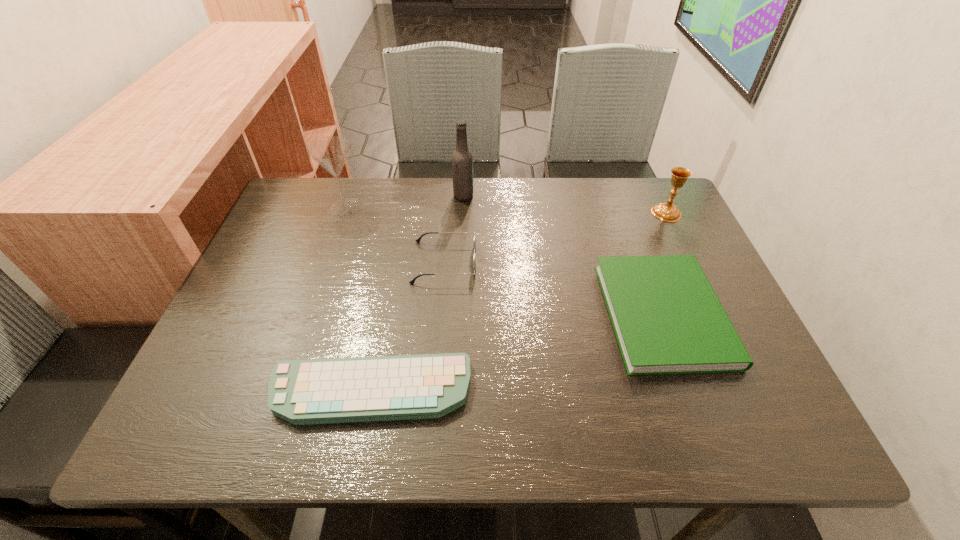
Identify the location of vacant region between the chalice and the flute glass. Image resolution: width=960 pixels, height=540 pixels. (506, 210).

The width and height of the screenshot is (960, 540). In order to click on vacant space in between the fourth shortest object and the tallest object in this screenshot , I will do `click(564, 204)`.

This screenshot has width=960, height=540. Identify the location of blank region between the second tallest object and the sunglasses. (395, 235).

Image resolution: width=960 pixels, height=540 pixels. Identify the location of free spot between the paperback book and the computer keyboard. (517, 352).

Locate an element on the screen. The image size is (960, 540). empty space that is in between the shortest object and the paperback book is located at coordinates (517, 352).

Locate an element on the screen. vacant area between the shortest object and the paperback book is located at coordinates (517, 352).

The image size is (960, 540). Find the location of `free space between the beer bottle and the shortest object`. free space between the beer bottle and the shortest object is located at coordinates (418, 293).

At what (x,y) coordinates should I click in order to perform the action: click on free area in between the third shortest object and the shortest object. Please return your answer as a coordinate pair (x, y). The width and height of the screenshot is (960, 540). Looking at the image, I should click on (408, 326).

I want to click on the fourth closest object to the third shortest object, so click(667, 319).

At what (x,y) coordinates should I click in order to perform the action: click on the fourth closest object to the third shortest object. Please return your answer as a coordinate pair (x, y). This screenshot has width=960, height=540. Looking at the image, I should click on (667, 319).